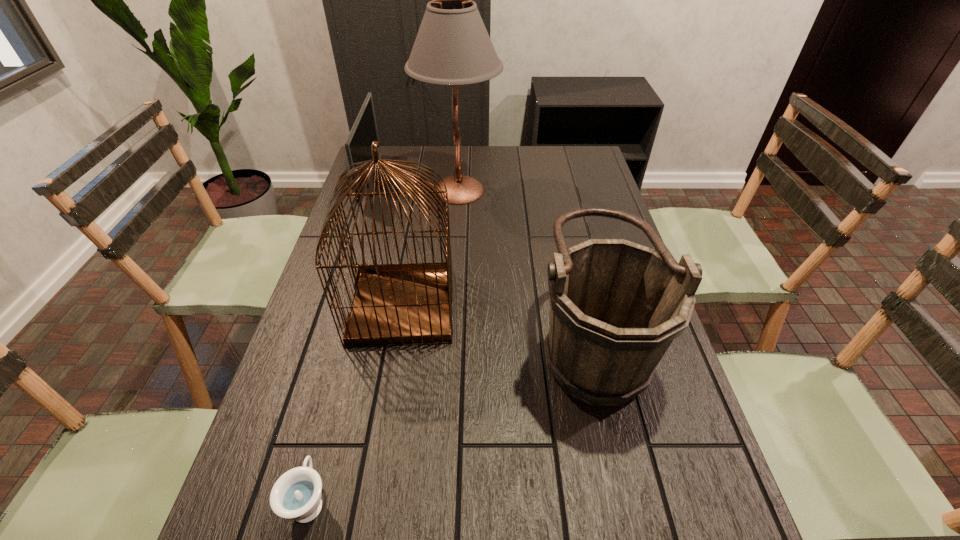
Find the location of a particular element. free space between the teacup and the fourth shortest object is located at coordinates (356, 403).

This screenshot has height=540, width=960. In order to click on free space between the nearest object and the birdcage in this screenshot , I will do `click(356, 403)`.

Select which object appears as the fourth closest to the fourth shortest object. Please provide its 2D coordinates. Your answer should be formatted as a tuple, i.e. [(x, y)], where the tuple contains the x and y coordinates of a point satisfying the conditions above.

[(296, 495)]

Identify the location of the third closest object to the rightmost object. (296, 495).

At what (x,y) coordinates should I click in order to perform the action: click on free space that satisfies the following two spatial constraints: 1. on the screen side of the monitor; 2. on the side of the teacup with the handle. Please return your answer as a coordinate pair (x, y). Looking at the image, I should click on (257, 500).